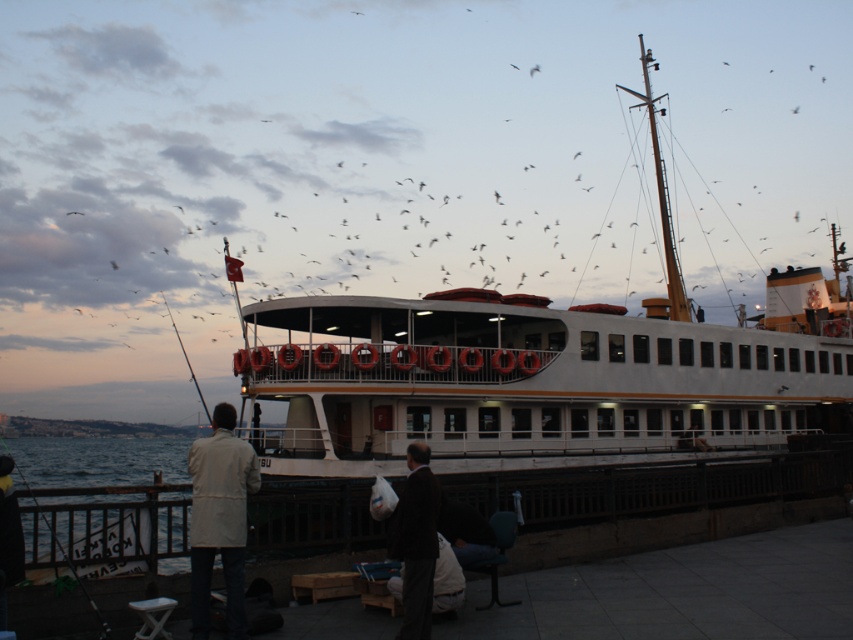
You are a photographer standing at the waterfront scene. You need to capture a photo of both the dark brown suit at center and the white cotton jacket at lower left in the same frame. Which clothing item will appear smaller in the photo?

The dark brown suit at center will appear smaller in the photo because it has a lesser width compared to the white cotton jacket at lower left.